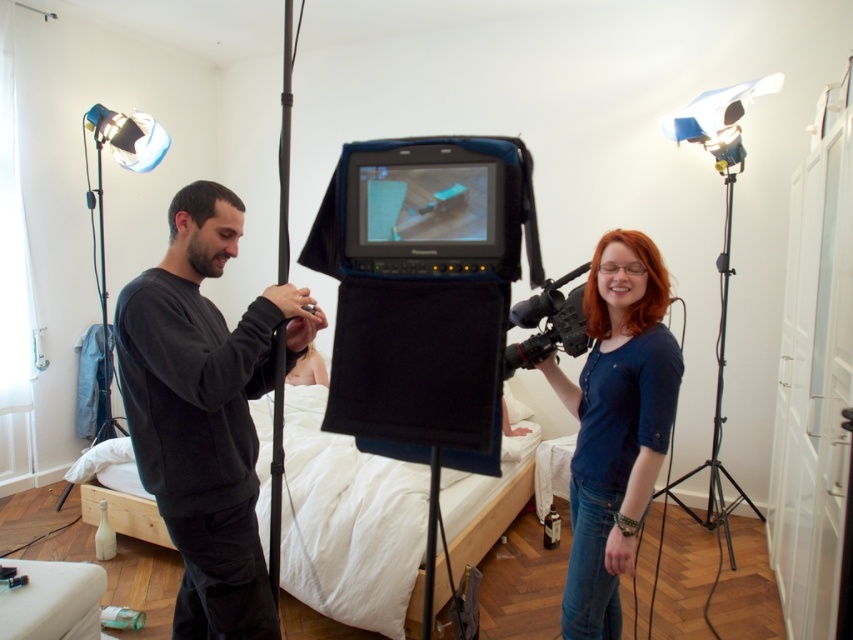
You are standing at the entrance of the room and see two points marked in the scene. Which point is closer to you, point (x=374, y=611) or point (x=720, y=268)?

Point (x=374, y=611) is in front of point (x=720, y=268), so it is closer to you.